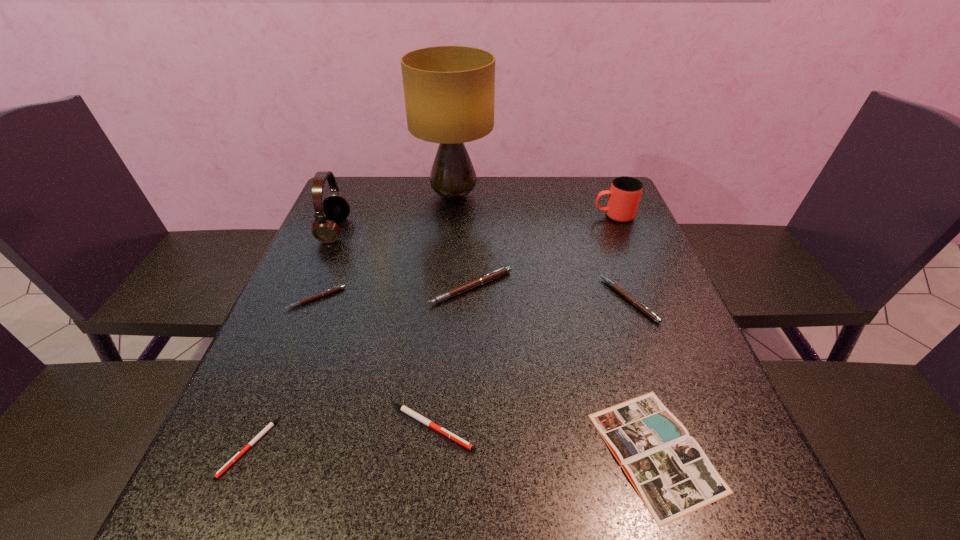
Identify the location of the tallest object. The height and width of the screenshot is (540, 960). (449, 91).

Identify the location of lampshade. (x=449, y=91).

Where is `black headset`? Image resolution: width=960 pixels, height=540 pixels. black headset is located at coordinates (336, 208).

Locate an element on the screen. The width and height of the screenshot is (960, 540). headset is located at coordinates (336, 208).

The width and height of the screenshot is (960, 540). I want to click on cup, so click(x=624, y=195).

Image resolution: width=960 pixels, height=540 pixels. I want to click on the third tallest object, so click(624, 195).

Image resolution: width=960 pixels, height=540 pixels. Find the location of `the biggest pink pen`. the biggest pink pen is located at coordinates (481, 280).

Where is `the tallest pen`? Image resolution: width=960 pixels, height=540 pixels. the tallest pen is located at coordinates (481, 280).

Where is `the fifth tallest object`? The height and width of the screenshot is (540, 960). the fifth tallest object is located at coordinates (626, 295).

Where is `the second tallest pen`? The width and height of the screenshot is (960, 540). the second tallest pen is located at coordinates (626, 295).